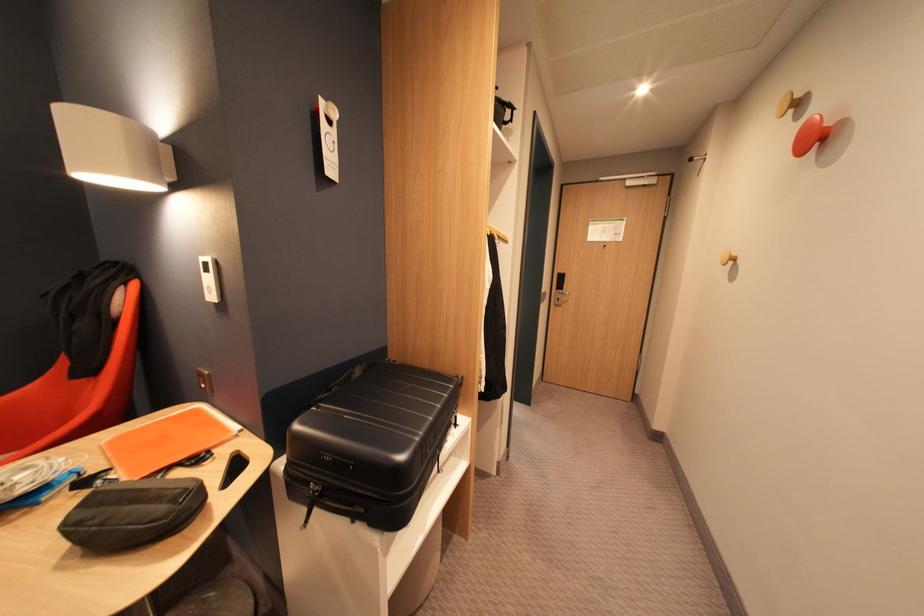
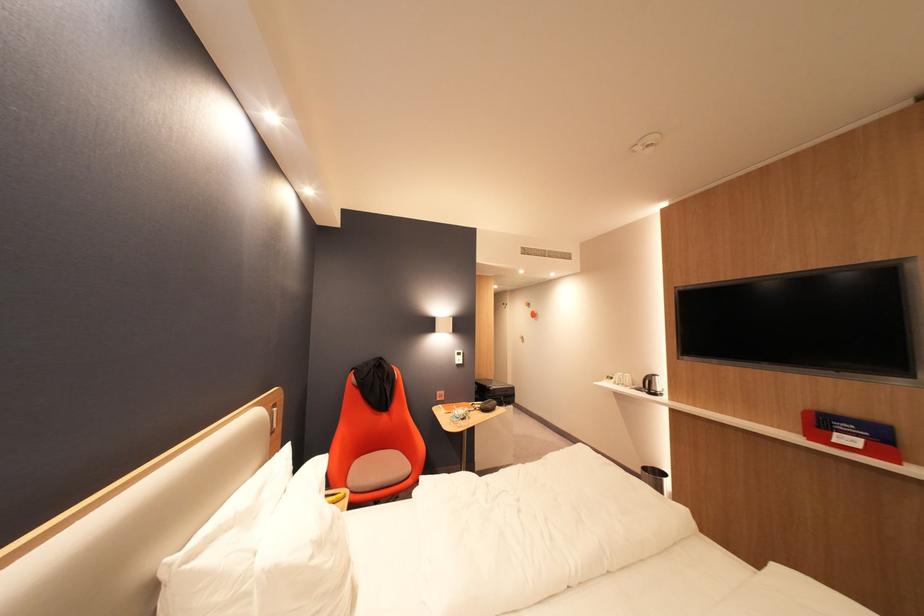
Locate, in the second image, the point that corresponds to the point at 306,427 in the first image.

(502, 390)